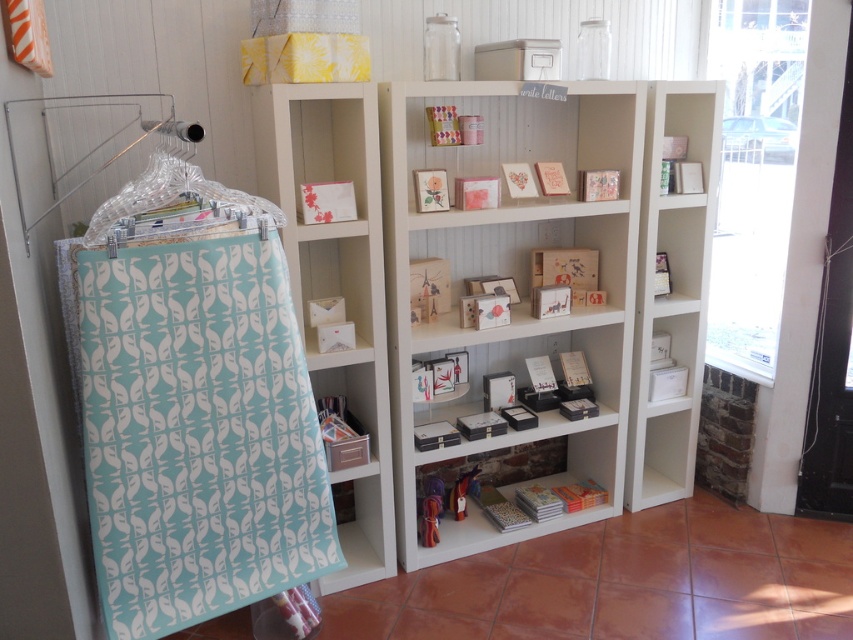
You have a rectangular box that is 15 inches wide. You want to place it on the white matte shelf at center or hang it on the clear plastic hanger at left. Which option can accommodate the box based on their widths?

The white matte shelf at center might be wider than the clear plastic hanger at left, so the box might fit better on the white matte shelf at center if its width is sufficient.

You are a customer in the store and want to reach an item on the white matte bookshelf at center. The white matte shelf at center is in your way. Can you move the shelf to access the bookshelf?

The white matte bookshelf at center is located above the white matte shelf at center, so you don not need to move the shelf to reach the bookshelf since it is positioned below.

You are a customer in the store and want to place a 1.2 meter long item between the white matte shelf at right and the clear plastic hanger at left. Is there enough space for it?

The distance between the white matte shelf at right and the clear plastic hanger at left is 1.50 meters, so yes, the 1.2 meter long item can fit between them since it is shorter than the available space.